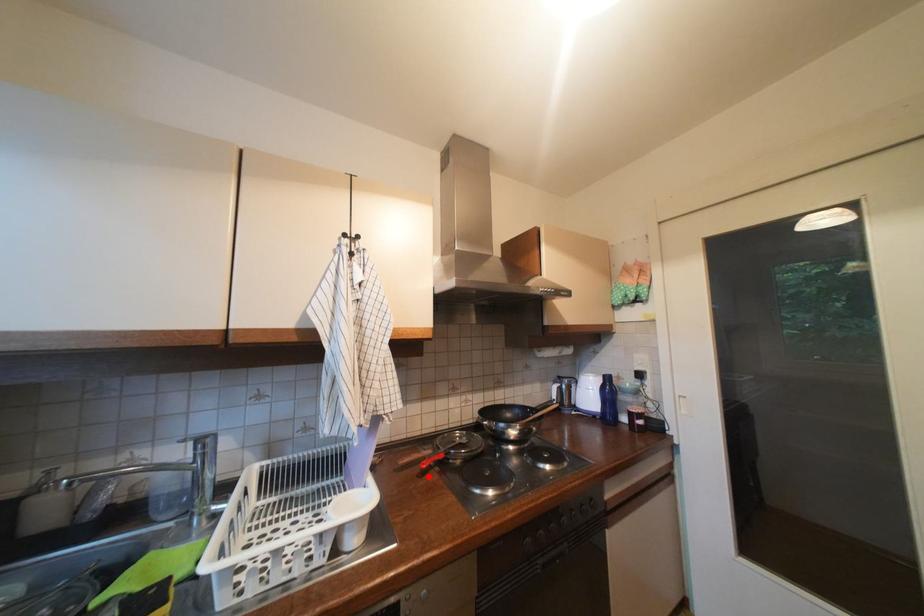
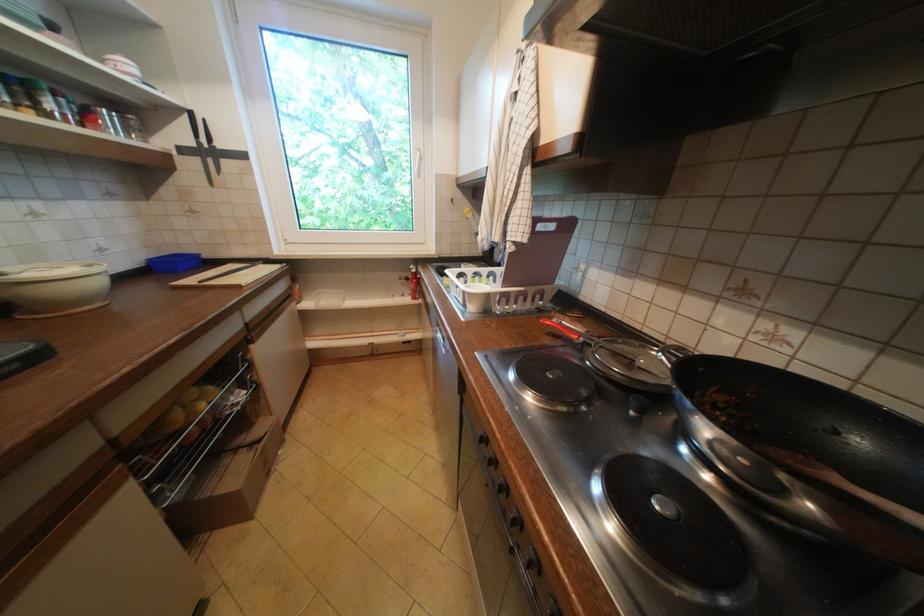
Locate, in the second image, the point that corresponds to the highlighted location in the first image.

(558, 334)